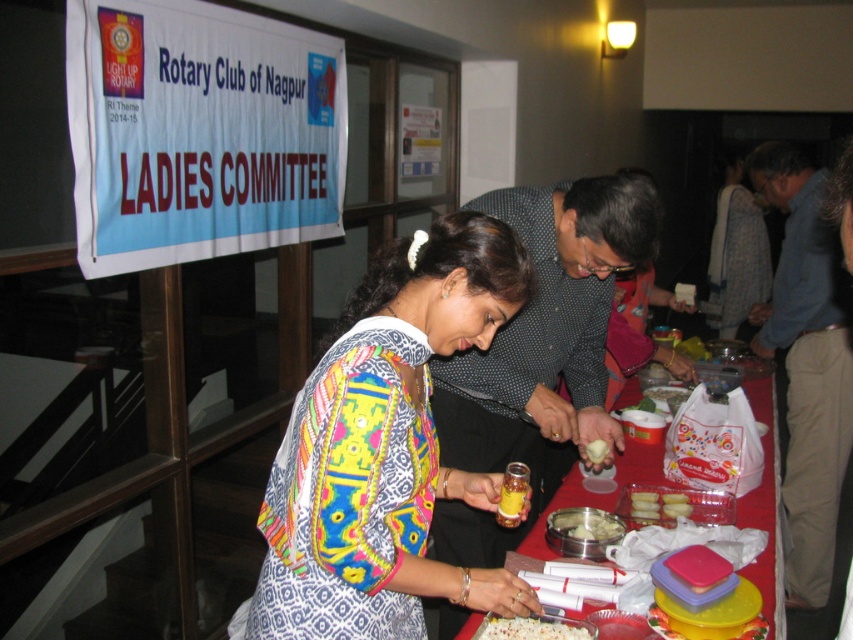
Question: Is printed fabric dress at center below translucent plastic table at center?

Choices:
 (A) no
 (B) yes

Answer: (A)

Question: Which object is the closest to the blue cotton shirt at center?

Choices:
 (A) patterned fabric dress at center
 (B) yellow matte food at center

Answer: (A)

Question: Is blue cotton shirt at center positioned before patterned fabric dress at center?

Choices:
 (A) yes
 (B) no

Answer: (A)

Question: Among these objects, which one is nearest to the camera?

Choices:
 (A) yellow matte cookies at center
 (B) blue cotton shirt at center
 (C) yellow matte food at center

Answer: (C)

Question: Where is printed fabric dress at center located in relation to patterned fabric dress at center in the image?

Choices:
 (A) below
 (B) above

Answer: (A)

Question: Which object is the farthest from the shiny metallic tray at center?

Choices:
 (A) translucent plastic table at center
 (B) printed fabric dress at center

Answer: (B)